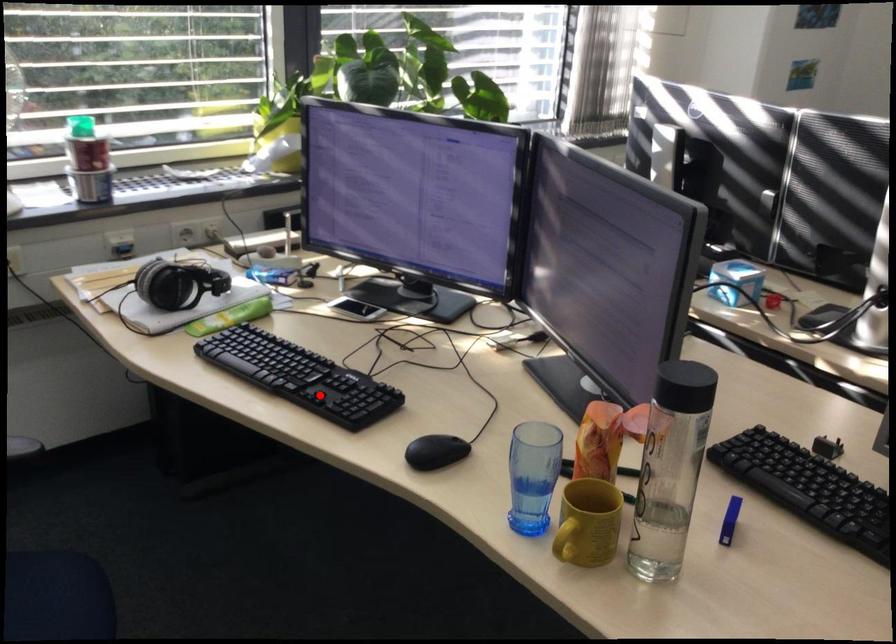
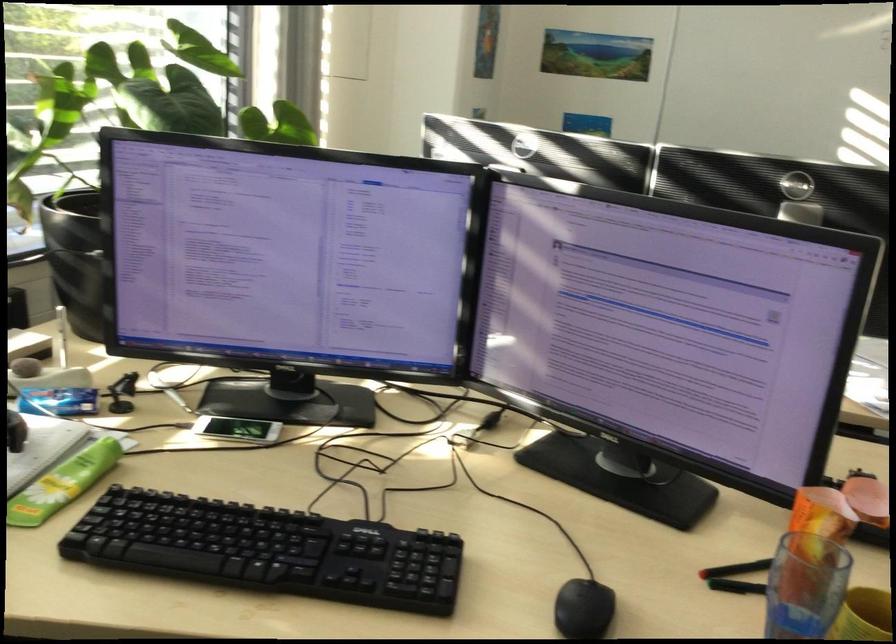
Question: I am providing you with two images of the same scene from different viewpoints. A red point is shown in image1. For the corresponding object point in image2, is it positioned nearer or farther from the camera?

Choices:
 (A) Nearer
 (B) Farther

Answer: (A)